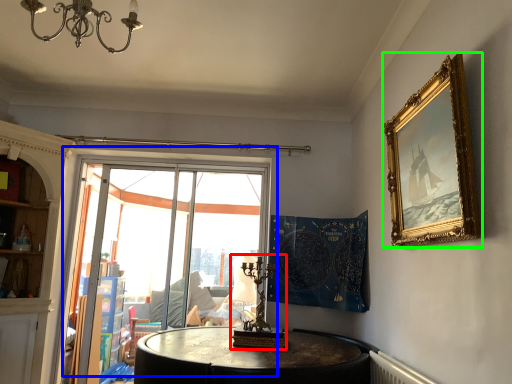
Question: Which object is positioned closest to candle holder (highlighted by a red box)? Select from window (highlighted by a blue box) and picture frame (highlighted by a green box).

Choices:
 (A) window
 (B) picture frame

Answer: (B)